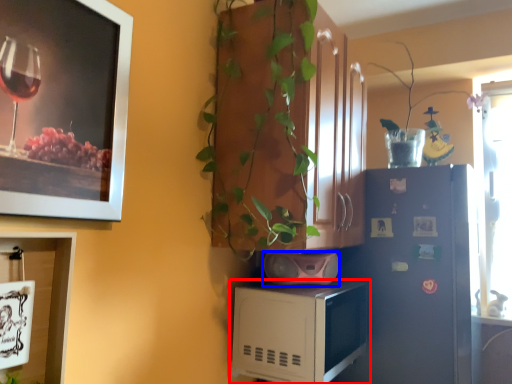
Question: Which object appears farthest to the camera in this image, microwave oven (highlighted by a red box) or appliance (highlighted by a blue box)?

Choices:
 (A) microwave oven
 (B) appliance

Answer: (B)